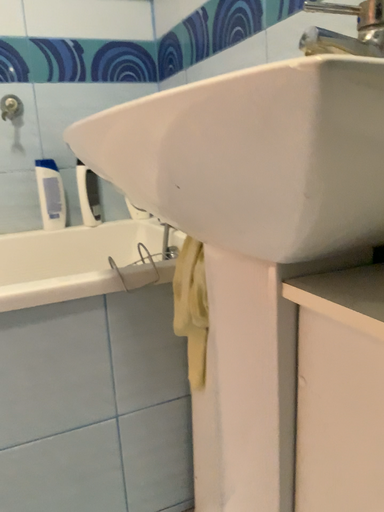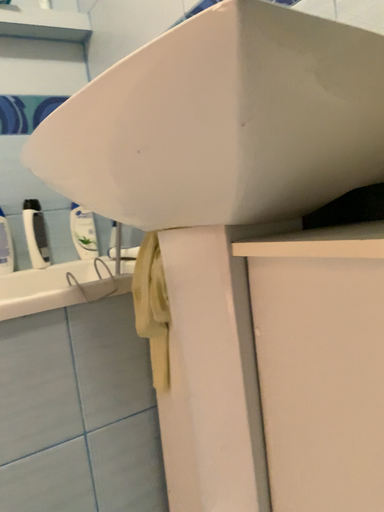
Question: How did the camera likely rotate when shooting the video?

Choices:
 (A) rotated right
 (B) rotated left

Answer: (A)